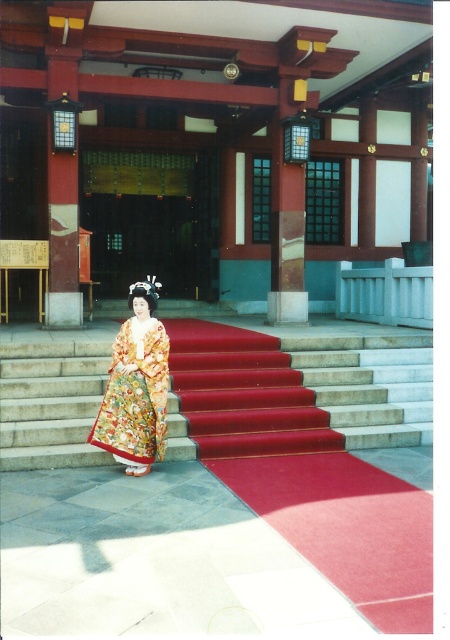
You are a visitor at the shrine entrance. You see the smooth concrete stairs at center and the floral silk kimono at center. Which object is wider?

The smooth concrete stairs at center is wider than the floral silk kimono at center.